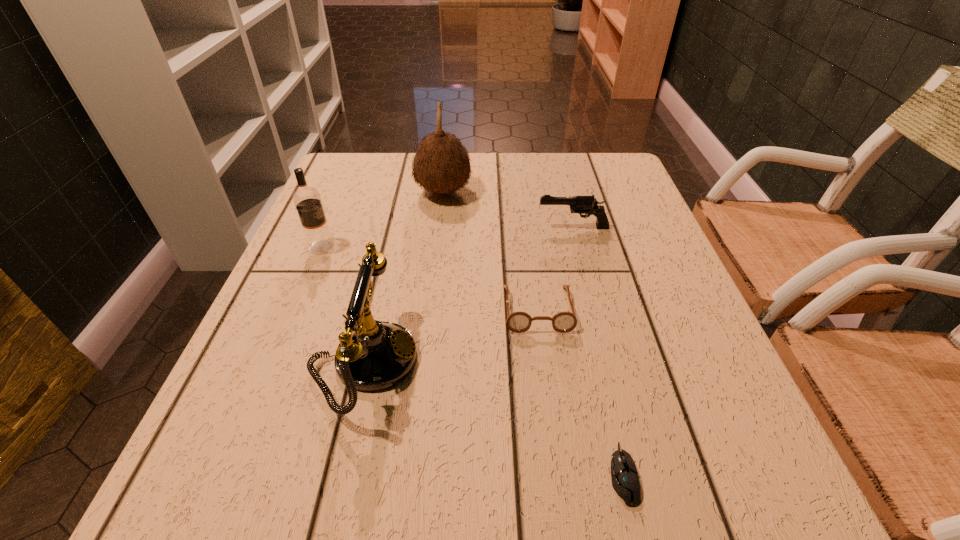
Locate an element on the screen. the farthest object is located at coordinates (441, 165).

What are the coordinates of `the third farthest object` in the screenshot? It's located at (307, 200).

What are the coordinates of `the leftmost object` in the screenshot? It's located at (307, 200).

Locate an element on the screen. This screenshot has width=960, height=540. telephone is located at coordinates (376, 355).

You are a GUI agent. You are given a task and a screenshot of the screen. Output one action in this format:
    pyautogui.click(x=<x>, y=<y>)
    Task: Click on the third shortest object
    
    Given the screenshot: What is the action you would take?
    pyautogui.click(x=588, y=205)

Where is `gun`? The image size is (960, 540). gun is located at coordinates (588, 205).

Find the location of `spectacles`. spectacles is located at coordinates (518, 322).

Find the location of a particular element. The width and height of the screenshot is (960, 540). the nearest object is located at coordinates (625, 480).

Where is `the shortest object`? The image size is (960, 540). the shortest object is located at coordinates (625, 480).

In order to click on free point located 0.390m on the surface of the farthest object in this screenshot , I will do `click(625, 192)`.